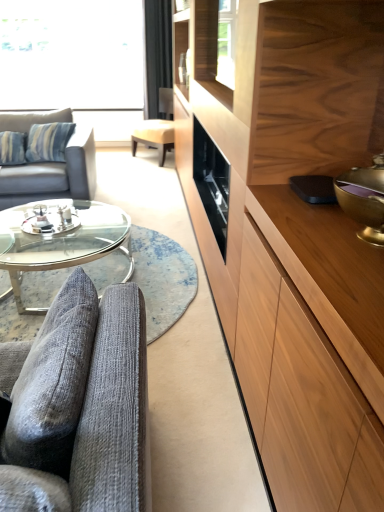
Question: Does clear glass coffee table at center have a larger size compared to light brown leather swivel chair at center?

Choices:
 (A) yes
 (B) no

Answer: (B)

Question: Is clear glass coffee table at center turned away from light brown leather swivel chair at center?

Choices:
 (A) yes
 (B) no

Answer: (B)

Question: Considering the relative sizes of clear glass coffee table at center and light brown leather swivel chair at center in the image provided, is clear glass coffee table at center wider than light brown leather swivel chair at center?

Choices:
 (A) yes
 (B) no

Answer: (A)

Question: Is clear glass coffee table at center directly adjacent to light brown leather swivel chair at center?

Choices:
 (A) no
 (B) yes

Answer: (A)

Question: Is clear glass coffee table at center far away from light brown leather swivel chair at center?

Choices:
 (A) no
 (B) yes

Answer: (B)

Question: From a real-world perspective, is clear glass coffee table at center on top of light brown leather swivel chair at center?

Choices:
 (A) no
 (B) yes

Answer: (A)

Question: Would you say light brown leather swivel chair at center is outside clear glass coffee table at center?

Choices:
 (A) no
 (B) yes

Answer: (B)

Question: Can you confirm if light brown leather swivel chair at center is positioned to the right of clear glass coffee table at center?

Choices:
 (A) no
 (B) yes

Answer: (B)

Question: Considering the relative sizes of light brown leather swivel chair at center and clear glass coffee table at center in the image provided, is light brown leather swivel chair at center shorter than clear glass coffee table at center?

Choices:
 (A) no
 (B) yes

Answer: (A)

Question: Considering the relative sizes of light brown leather swivel chair at center and clear glass coffee table at center in the image provided, is light brown leather swivel chair at center bigger than clear glass coffee table at center?

Choices:
 (A) yes
 (B) no

Answer: (A)

Question: Is light brown leather swivel chair at center positioned with its back to clear glass coffee table at center?

Choices:
 (A) no
 (B) yes

Answer: (A)

Question: From the image's perspective, is light brown leather swivel chair at center located above clear glass coffee table at center?

Choices:
 (A) yes
 (B) no

Answer: (A)

Question: Could you tell me if light brown wood drawer at right is facing black fabric curtain at upper center?

Choices:
 (A) yes
 (B) no

Answer: (B)